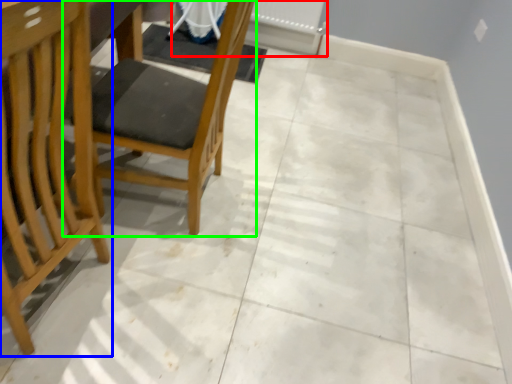
Question: Which object is the farthest from radiator (highlighted by a red box)? Choose among these: chair (highlighted by a blue box) or chair (highlighted by a green box).

Choices:
 (A) chair
 (B) chair

Answer: (A)